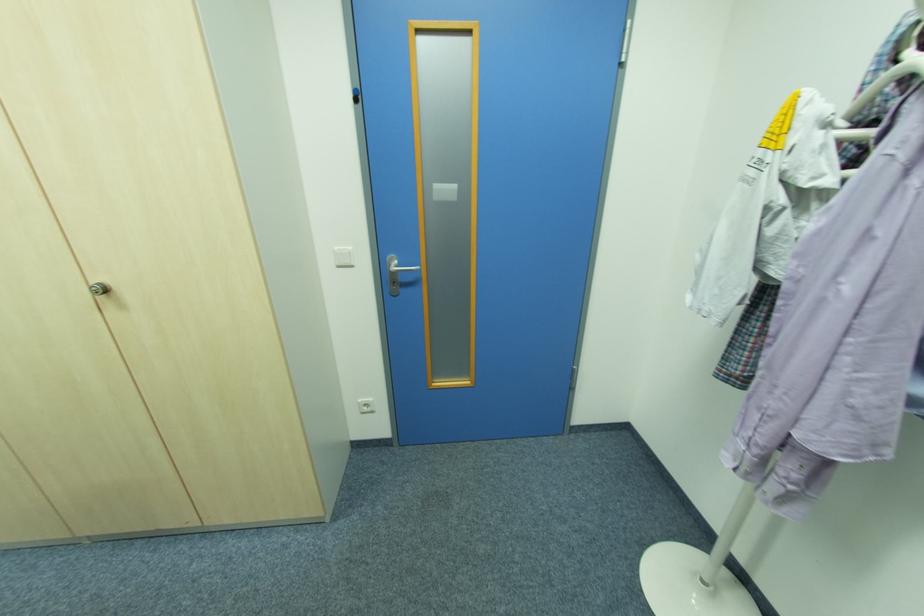
What do you see at coordinates (396, 274) in the screenshot? The width and height of the screenshot is (924, 616). I see `the silver door handle` at bounding box center [396, 274].